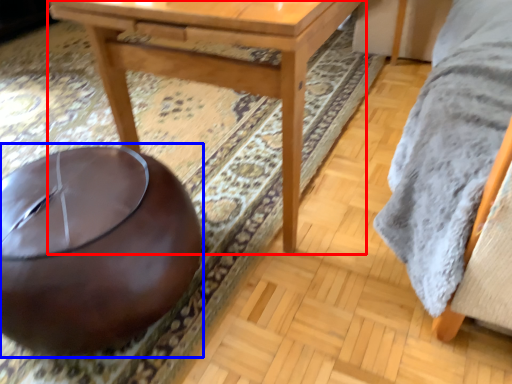
Question: Which point is further to the camera, table (highlighted by a red box) or bean bag chair (highlighted by a blue box)?

Choices:
 (A) table
 (B) bean bag chair

Answer: (A)